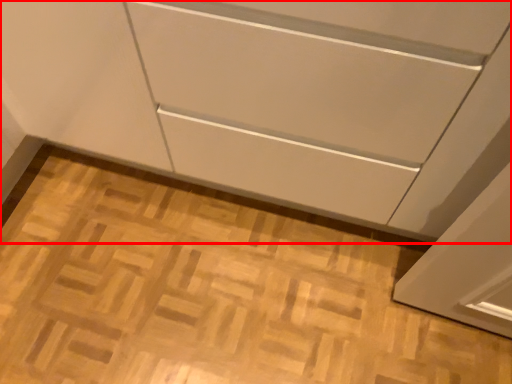
Question: From the image's perspective, what is the correct spatial relationship of cabinetry (annotated by the red box) in relation to plain?

Choices:
 (A) above
 (B) below

Answer: (A)